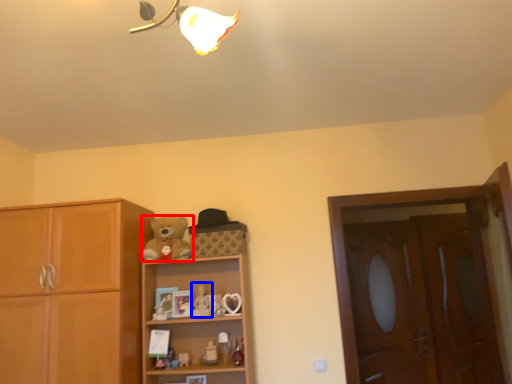
Question: Which point is closer to the camera, teddy bear (highlighted by a red box) or toy (highlighted by a blue box)?

Choices:
 (A) teddy bear
 (B) toy

Answer: (A)